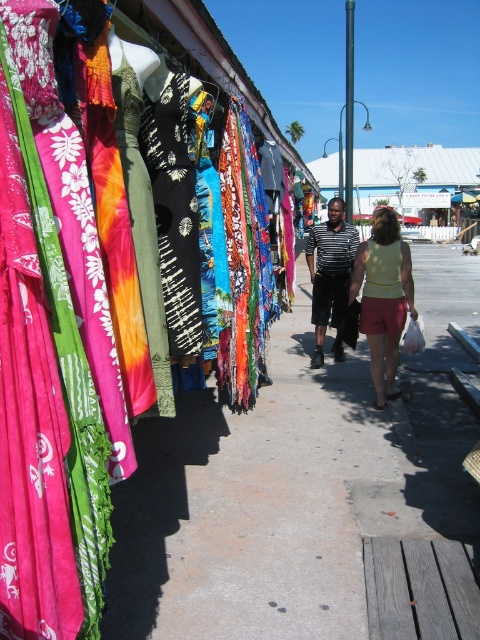
Can you confirm if striped cotton shirt at center is wider than light yellow fabric shorts at center?

Correct, the width of striped cotton shirt at center exceeds that of light yellow fabric shorts at center.

Measure the distance between striped cotton shirt at center and camera.

striped cotton shirt at center is 5.82 meters from camera.

Find the location of a particular element. The height and width of the screenshot is (640, 480). striped cotton shirt at center is located at coordinates (331, 269).

This screenshot has width=480, height=640. I want to click on striped cotton shirt at center, so click(331, 269).

Which is in front, point (356, 486) or point (372, 291)?

Positioned in front is point (356, 486).

Measure the distance between point (184, 544) and camera.

Point (184, 544) is 9.91 feet away from camera.

Is point (180, 513) positioned before point (389, 332)?

Yes, it is in front of point (389, 332).

Image resolution: width=480 pixels, height=640 pixels. What are the coordinates of `smooth concrete sidewalk at center` in the screenshot? It's located at (296, 484).

Which is in front, point (66, 428) or point (466, 512)?

Positioned in front is point (66, 428).

Find the location of a particular element. matte fabric dress at upper left is located at coordinates (66, 330).